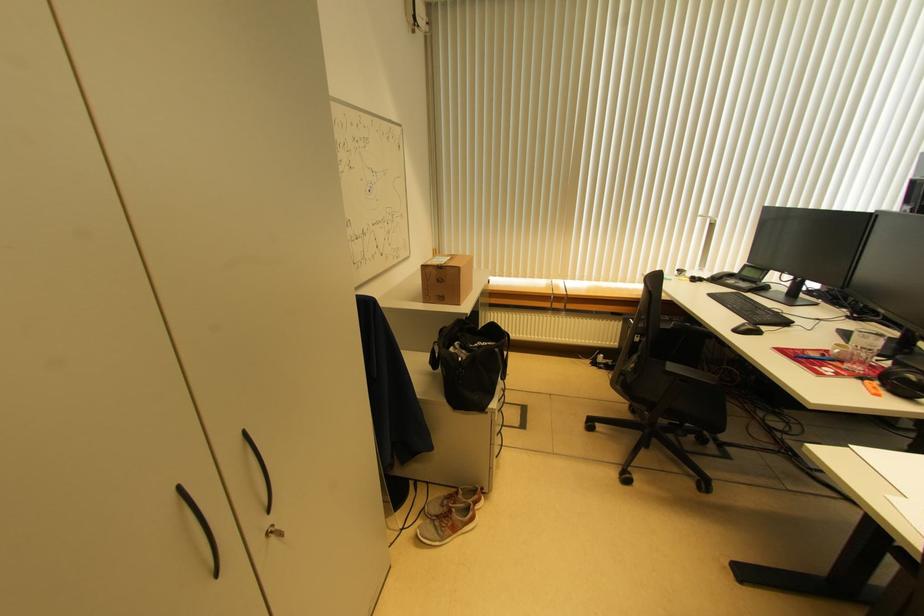
In order to click on black computer mouse in this screenshot , I will do pos(747,329).